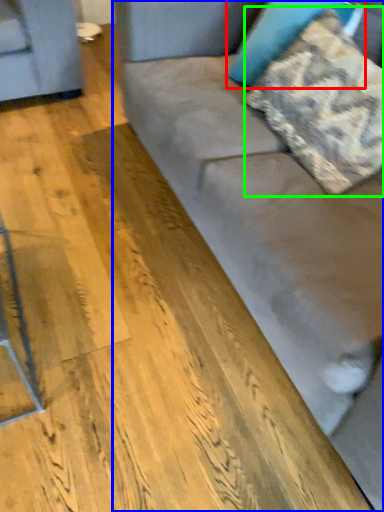
Question: Estimate the real-world distances between objects in this image. Which object is farther from pillow (highlighted by a red box), studio couch (highlighted by a blue box) or pillow (highlighted by a green box)?

Choices:
 (A) studio couch
 (B) pillow

Answer: (A)